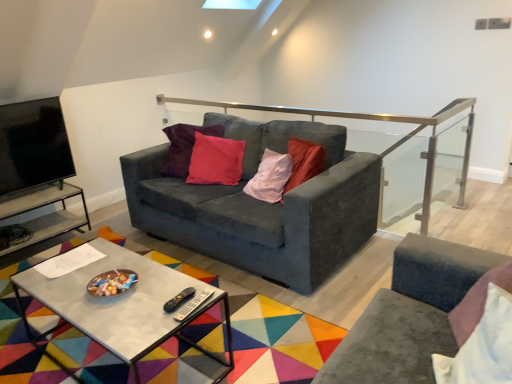
Question: Do you think satin silver rail at upper center is within velvet dark gray couch at center, or outside of it?

Choices:
 (A) inside
 (B) outside

Answer: (A)

Question: Is satin silver rail at upper center bigger or smaller than velvet dark gray couch at center?

Choices:
 (A) small
 (B) big

Answer: (A)

Question: Which object is positioned farthest from the satin silver rail at upper center?

Choices:
 (A) velvet dark gray couch at center
 (B) metal/glass side table at left
 (C) matte black tv stand at left
 (D) concrete rectangular table at center
 (E) white soft pillow at lower right

Answer: (C)

Question: Which is nearer to the matte black tv stand at left?

Choices:
 (A) satin silver rail at upper center
 (B) concrete rectangular table at center
 (C) metal/glass side table at left
 (D) white soft pillow at lower right
 (E) velvet dark gray couch at center

Answer: (C)